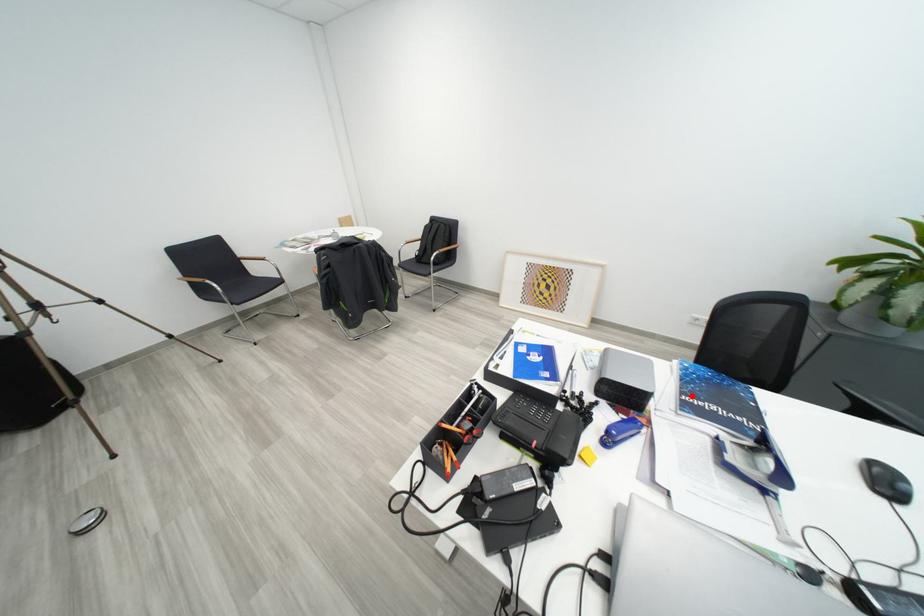
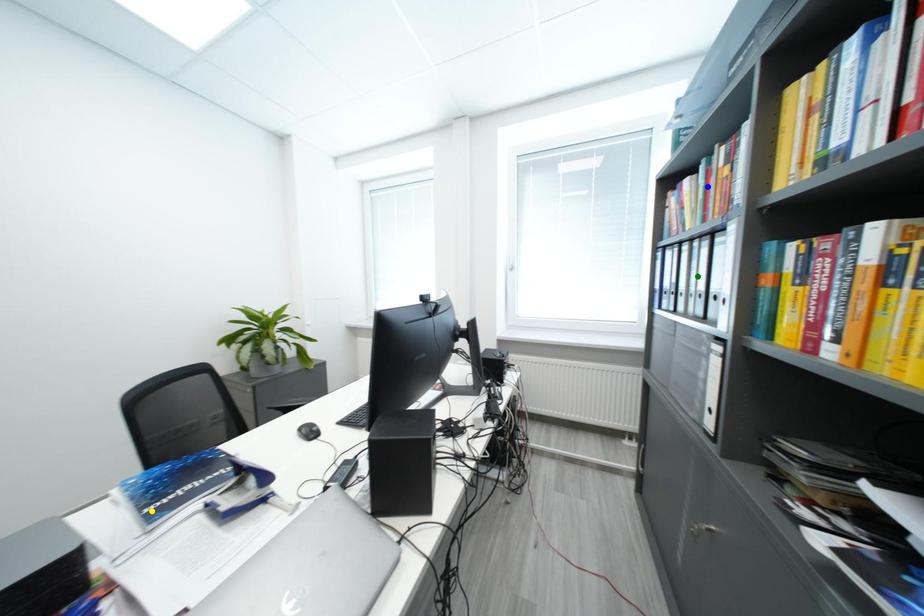
Question: I am providing you with two images of the same scene from different viewpoints. A red point is marked on the first image. You are given multiple points on the second image. Which point in image 2 is actually the same real-world point as the red point in image 1?

Choices:
 (A) green point
 (B) yellow point
 (C) blue point

Answer: (B)